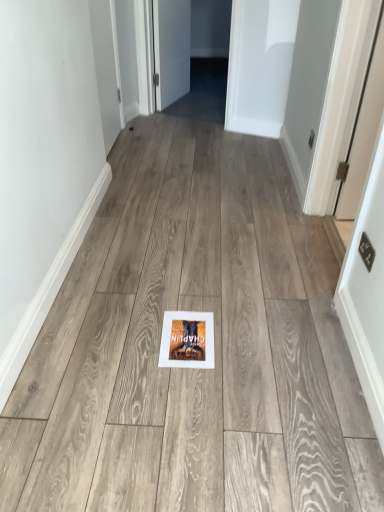
The height and width of the screenshot is (512, 384). In order to click on unoccupied region to the right of matte gold postcard at center in this screenshot , I will do point(242,334).